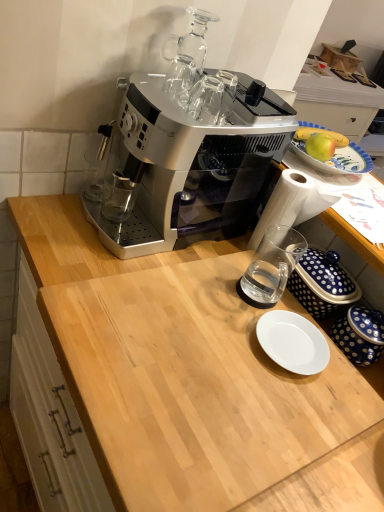
At what (x,y) coordinates should I click in order to perform the action: click on free space in front of blue dotted ceramic jar at lower right. Please return your answer as a coordinate pair (x, y). This screenshot has width=384, height=512. Looking at the image, I should click on (336, 394).